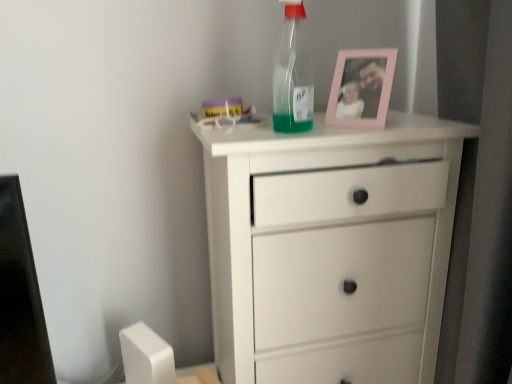
What are the coordinates of `white matte chest of drawers at center` in the screenshot? It's located at click(330, 249).

Considering the positions of objects transparent plastic bottle at upper center and white matte chest of drawers at center in the image provided, who is more to the left, transparent plastic bottle at upper center or white matte chest of drawers at center?

Positioned to the left is transparent plastic bottle at upper center.

Can you tell me how much transparent plastic bottle at upper center and white matte chest of drawers at center differ in facing direction?

There is a 7.24-degree angle between the facing directions of transparent plastic bottle at upper center and white matte chest of drawers at center.

Between transparent plastic bottle at upper center and white matte chest of drawers at center, which one has smaller size?

transparent plastic bottle at upper center.

Would you say transparent plastic bottle at upper center is a long distance from white matte chest of drawers at center?

That's not correct — transparent plastic bottle at upper center is a little close to white matte chest of drawers at center.

Is white matte chest of drawers at center turned away from pink plastic picture frame at upper center?

No, white matte chest of drawers at center's orientation is not away from pink plastic picture frame at upper center.

Considering the sizes of objects white matte chest of drawers at center and pink plastic picture frame at upper center in the image provided, who is smaller, white matte chest of drawers at center or pink plastic picture frame at upper center?

Smaller between the two is pink plastic picture frame at upper center.

What's the angular difference between transparent plastic bottle at upper center and pink plastic picture frame at upper center's facing directions?

There is a 49.6-degree angle between the facing directions of transparent plastic bottle at upper center and pink plastic picture frame at upper center.

Between transparent plastic bottle at upper center and pink plastic picture frame at upper center, which one appears on the right side from the viewer's perspective?

pink plastic picture frame at upper center is more to the right.

Considering the sizes of transparent plastic bottle at upper center and pink plastic picture frame at upper center in the image, is transparent plastic bottle at upper center taller or shorter than pink plastic picture frame at upper center?

transparent plastic bottle at upper center is taller than pink plastic picture frame at upper center.

From the image's perspective, is transparent plastic bottle at upper center above or below pink plastic picture frame at upper center?

From the image's perspective, transparent plastic bottle at upper center appears above pink plastic picture frame at upper center.

Is pink plastic picture frame at upper center bigger than white matte chest of drawers at center?

Incorrect, pink plastic picture frame at upper center is not larger than white matte chest of drawers at center.

Is pink plastic picture frame at upper center further to the viewer compared to white matte chest of drawers at center?

Yes, the depth of pink plastic picture frame at upper center is greater than that of white matte chest of drawers at center.

Do you think pink plastic picture frame at upper center is within white matte chest of drawers at center, or outside of it?

pink plastic picture frame at upper center is not enclosed by white matte chest of drawers at center.

Which of these two, pink plastic picture frame at upper center or transparent plastic bottle at upper center, stands taller?

With more height is transparent plastic bottle at upper center.

Is pink plastic picture frame at upper center not within transparent plastic bottle at upper center?

Yes, pink plastic picture frame at upper center is located beyond the bounds of transparent plastic bottle at upper center.

Which is farther, (362, 101) or (289, 73)?

The point (362, 101) is behind.

From the image's perspective, does pink plastic picture frame at upper center appear lower than transparent plastic bottle at upper center?

Yes, from the image's perspective, pink plastic picture frame at upper center is beneath transparent plastic bottle at upper center.

Consider the image. In the image, is white matte chest of drawers at center positioned in front of or behind transparent plastic bottle at upper center?

white matte chest of drawers at center is positioned closer to the viewer than transparent plastic bottle at upper center.

Locate an element on the screen. The height and width of the screenshot is (384, 512). bottle that is above the white matte chest of drawers at center (from the image's perspective) is located at coordinates (292, 77).

Can you tell me how much white matte chest of drawers at center and transparent plastic bottle at upper center differ in facing direction?

The angular difference between white matte chest of drawers at center and transparent plastic bottle at upper center is 7.24 degrees.

From the image's perspective, between white matte chest of drawers at center and transparent plastic bottle at upper center, who is located below?

From the image's view, white matte chest of drawers at center is below.

You are a GUI agent. You are given a task and a screenshot of the screen. Output one action in this format:
    pyautogui.click(x=<x>, y=<y>)
    Task: Click on the bottle above the white matte chest of drawers at center (from a real-world perspective)
    The height and width of the screenshot is (384, 512).
    Given the screenshot: What is the action you would take?
    pyautogui.click(x=292, y=77)

The image size is (512, 384). Find the location of `the chest of drawers located underneath the pink plastic picture frame at upper center (from a real-world perspective)`. the chest of drawers located underneath the pink plastic picture frame at upper center (from a real-world perspective) is located at coordinates (330, 249).

Estimate the real-world distances between objects in this image. Which object is closer to transparent plastic bottle at upper center, white matte chest of drawers at center or pink plastic picture frame at upper center?

pink plastic picture frame at upper center is closer to transparent plastic bottle at upper center.

Based on their spatial positions, is white matte chest of drawers at center or transparent plastic bottle at upper center further from pink plastic picture frame at upper center?

white matte chest of drawers at center lies further to pink plastic picture frame at upper center than the other object.

When comparing their distances from transparent plastic bottle at upper center, does pink plastic picture frame at upper center or white matte chest of drawers at center seem closer?

pink plastic picture frame at upper center is closer to transparent plastic bottle at upper center.

Looking at the image, which one is located further to white matte chest of drawers at center, pink plastic picture frame at upper center or transparent plastic bottle at upper center?

Based on the image, transparent plastic bottle at upper center appears to be further to white matte chest of drawers at center.

Estimate the real-world distances between objects in this image. Which object is further from pink plastic picture frame at upper center, transparent plastic bottle at upper center or white matte chest of drawers at center?

Based on the image, white matte chest of drawers at center appears to be further to pink plastic picture frame at upper center.

Based on their spatial positions, is transparent plastic bottle at upper center or pink plastic picture frame at upper center further from white matte chest of drawers at center?

transparent plastic bottle at upper center is further to white matte chest of drawers at center.

Locate an element on the screen. This screenshot has height=384, width=512. picture frame between transparent plastic bottle at upper center and white matte chest of drawers at center from top to bottom is located at coordinates (361, 88).